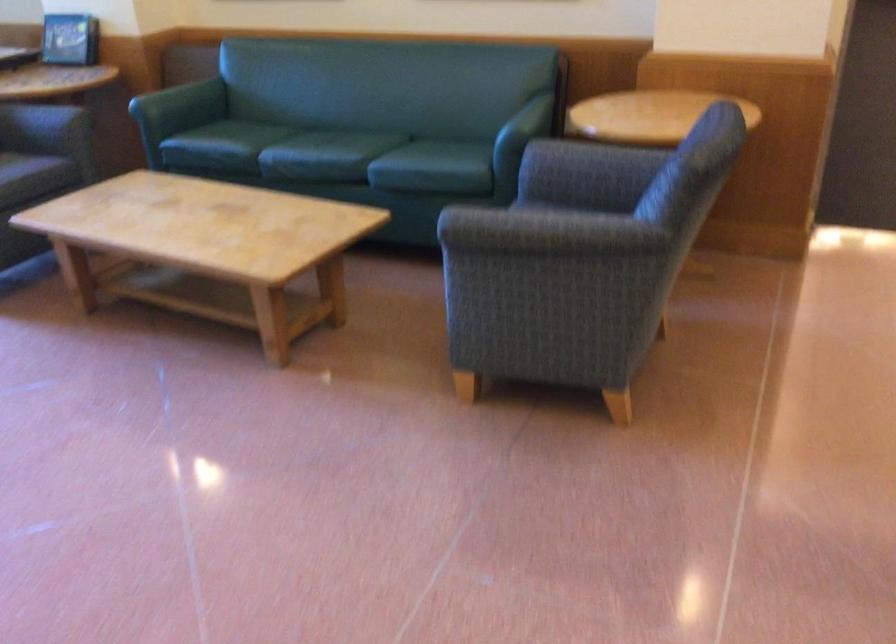
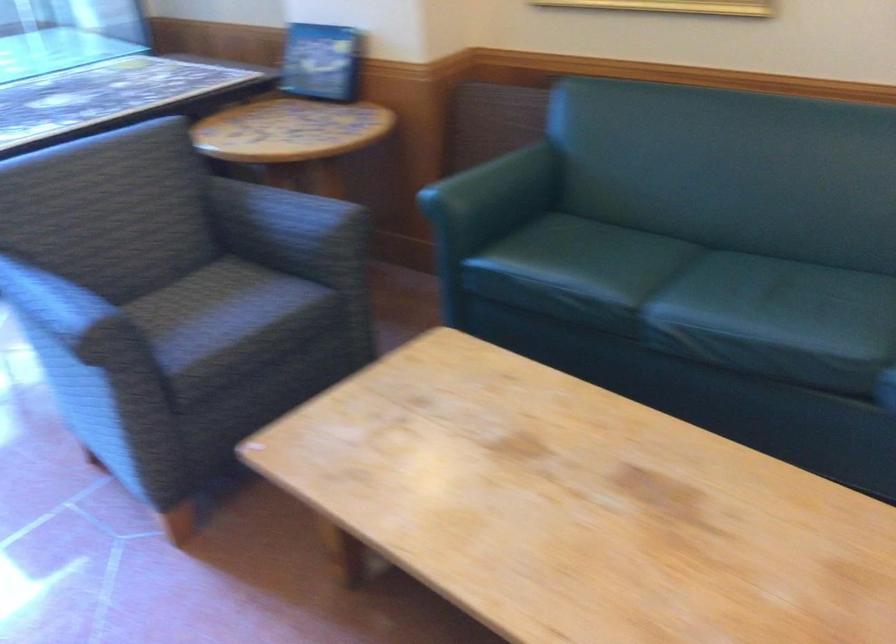
In the second image, find the point that corresponds to (177,91) in the first image.

(496, 182)